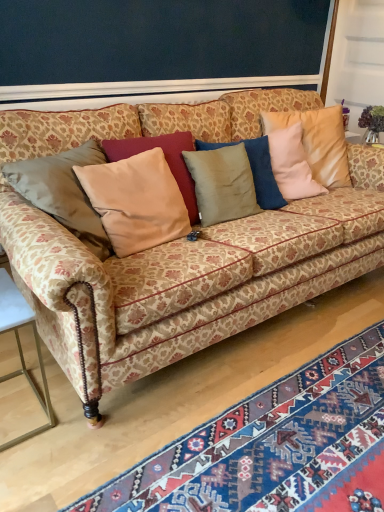
Question: Is satin beige pillow at center, which is the second pillow in left-to-right order, facing away from patterned fabric couch at center?

Choices:
 (A) no
 (B) yes

Answer: (B)

Question: From the image's perspective, does satin beige pillow at center, arranged as the 1th pillow when viewed from the right, appear higher than patterned fabric couch at center?

Choices:
 (A) no
 (B) yes

Answer: (B)

Question: Is satin beige pillow at center, which is the second pillow in left-to-right order, closer to the viewer compared to patterned fabric couch at center?

Choices:
 (A) no
 (B) yes

Answer: (A)

Question: Is satin beige pillow at center, which is the second pillow in left-to-right order, smaller than patterned fabric couch at center?

Choices:
 (A) yes
 (B) no

Answer: (A)

Question: Considering the relative sizes of satin beige pillow at center, which is the second pillow in left-to-right order, and patterned fabric couch at center in the image provided, is satin beige pillow at center, which is the second pillow in left-to-right order, thinner than patterned fabric couch at center?

Choices:
 (A) yes
 (B) no

Answer: (A)

Question: In terms of size, does blue woven rug at lower right appear bigger or smaller than satin beige pillow at center, which is the second pillow in left-to-right order?

Choices:
 (A) small
 (B) big

Answer: (B)

Question: From the image's perspective, is blue woven rug at lower right located above or below satin beige pillow at center, arranged as the 1th pillow when viewed from the right?

Choices:
 (A) above
 (B) below

Answer: (B)

Question: Is blue woven rug at lower right situated inside satin beige pillow at center, arranged as the 1th pillow when viewed from the right, or outside?

Choices:
 (A) inside
 (B) outside

Answer: (B)

Question: Considering the positions of point (367, 430) and point (324, 145), is point (367, 430) closer or farther from the camera than point (324, 145)?

Choices:
 (A) farther
 (B) closer

Answer: (B)

Question: Looking at the image, does gold metallic table at lower left seem bigger or smaller compared to patterned fabric couch at center?

Choices:
 (A) big
 (B) small

Answer: (B)

Question: In the image, is gold metallic table at lower left positioned in front of or behind patterned fabric couch at center?

Choices:
 (A) front
 (B) behind

Answer: (B)

Question: From the image's perspective, is gold metallic table at lower left located above or below patterned fabric couch at center?

Choices:
 (A) above
 (B) below

Answer: (B)

Question: Based on their positions, is gold metallic table at lower left located to the left or right of patterned fabric couch at center?

Choices:
 (A) left
 (B) right

Answer: (A)

Question: Considering the relative positions of satin beige pillow at center, which is the second pillow in left-to-right order, and blue woven rug at lower right in the image provided, is satin beige pillow at center, which is the second pillow in left-to-right order, to the left or to the right of blue woven rug at lower right?

Choices:
 (A) left
 (B) right

Answer: (B)

Question: From a real-world perspective, is satin beige pillow at center, arranged as the 1th pillow when viewed from the right, physically located above or below blue woven rug at lower right?

Choices:
 (A) above
 (B) below

Answer: (A)